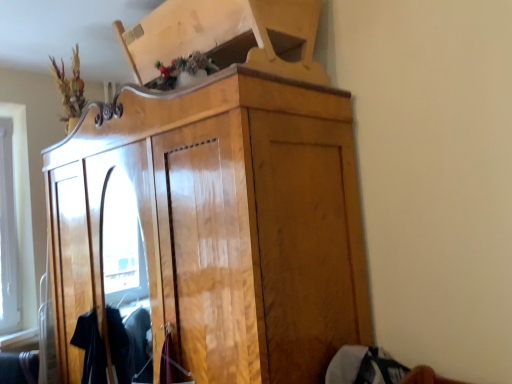
Question: From a real-world perspective, is glossy wood cupboard at center physically located above or below gray cotton sweater at lower right?

Choices:
 (A) above
 (B) below

Answer: (A)

Question: Considering the positions of glossy wood cupboard at center and gray cotton sweater at lower right in the image, is glossy wood cupboard at center wider or thinner than gray cotton sweater at lower right?

Choices:
 (A) wide
 (B) thin

Answer: (A)

Question: Visually, is glossy wood cupboard at center positioned to the left or to the right of gray cotton sweater at lower right?

Choices:
 (A) left
 (B) right

Answer: (A)

Question: Considering the positions of gray cotton sweater at lower right and glossy wood cupboard at center in the image, is gray cotton sweater at lower right bigger or smaller than glossy wood cupboard at center?

Choices:
 (A) big
 (B) small

Answer: (B)

Question: Is gray cotton sweater at lower right in front of or behind glossy wood cupboard at center in the image?

Choices:
 (A) behind
 (B) front

Answer: (A)

Question: From the image's perspective, is gray cotton sweater at lower right above or below glossy wood cupboard at center?

Choices:
 (A) below
 (B) above

Answer: (A)

Question: From a real-world perspective, is gray cotton sweater at lower right above or below glossy wood cupboard at center?

Choices:
 (A) above
 (B) below

Answer: (B)